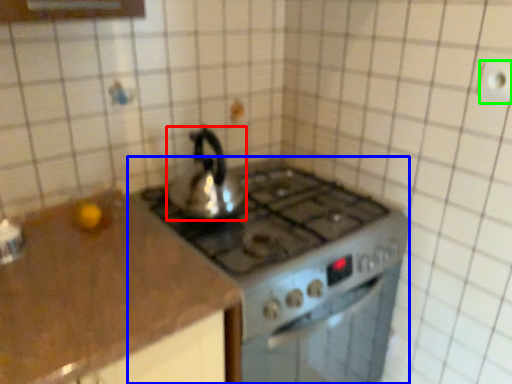
Question: Estimate the real-world distances between objects in this image. Which object is farther from kettle (highlighted by a red box), gas stove (highlighted by a blue box) or electric outlet (highlighted by a green box)?

Choices:
 (A) gas stove
 (B) electric outlet

Answer: (B)